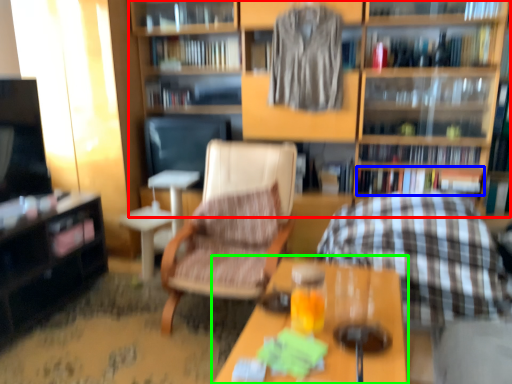
Question: Which object is positioned farthest from shelf (highlighted by a red box)? Select from book (highlighted by a blue box) and table (highlighted by a green box).

Choices:
 (A) book
 (B) table

Answer: (B)